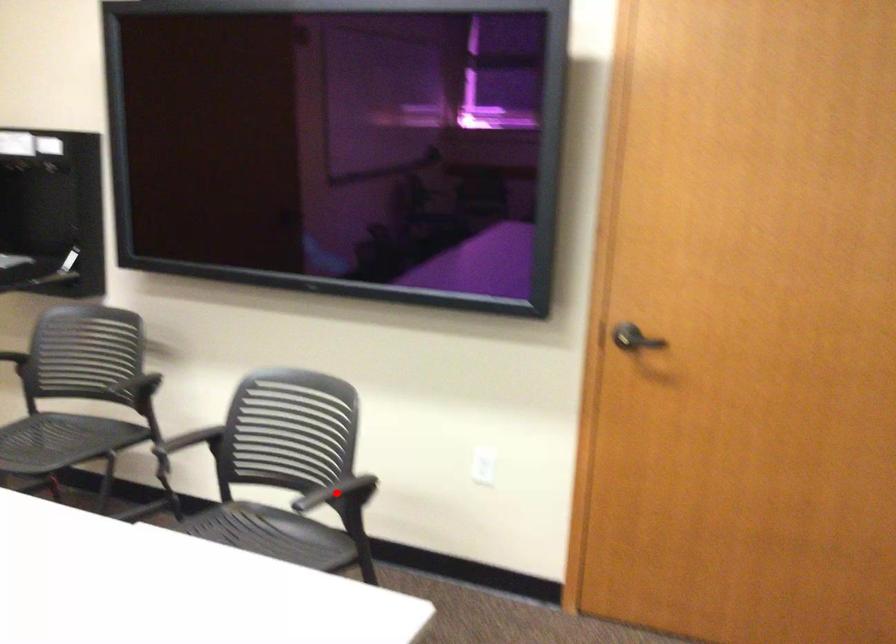
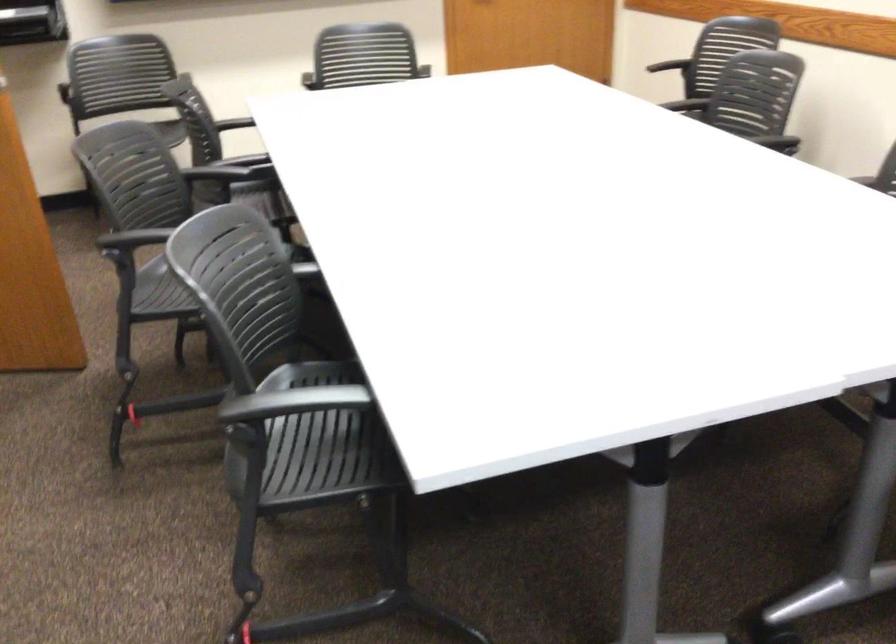
Question: I am providing you with two images of the same scene from different viewpoints. A red point is marked on the first image. At the location where the point appears in image 1, is it still visible in image 2?

Choices:
 (A) Yes
 (B) No

Answer: (B)